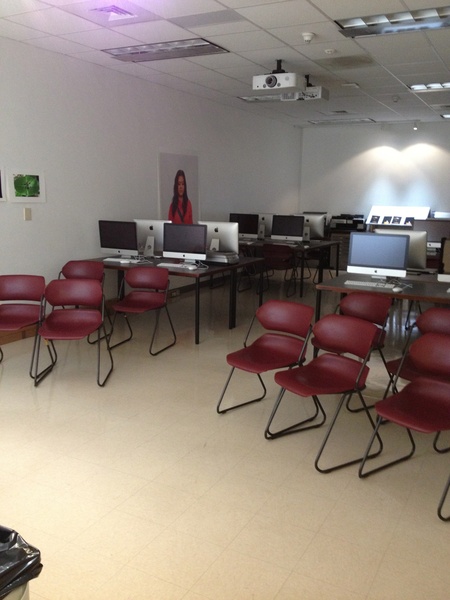
Where is `computers`? This screenshot has width=450, height=600. computers is located at coordinates (385, 246).